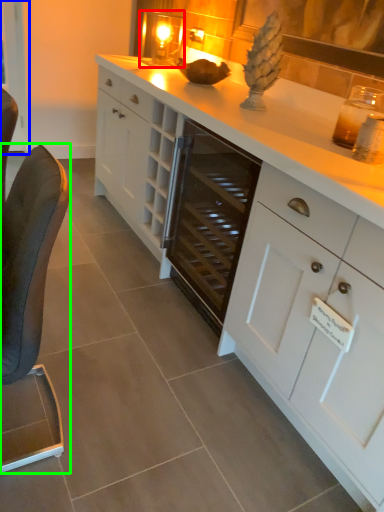
Question: Which object is positioned closest to candle holder (highlighted by a red box)? Select from glass door (highlighted by a blue box) and furniture (highlighted by a green box).

Choices:
 (A) glass door
 (B) furniture

Answer: (A)